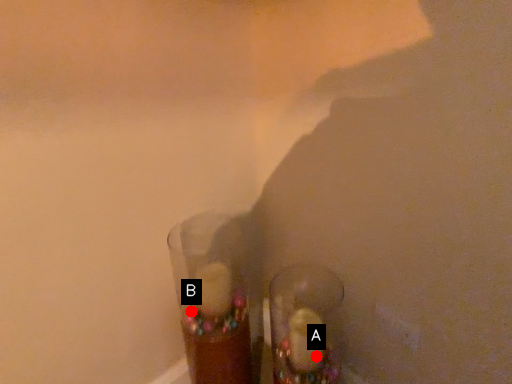
Question: Two points are circled on the image, labeled by A and B beside each circle. Which point is farther to the camera?

Choices:
 (A) A is further
 (B) B is further

Answer: (B)